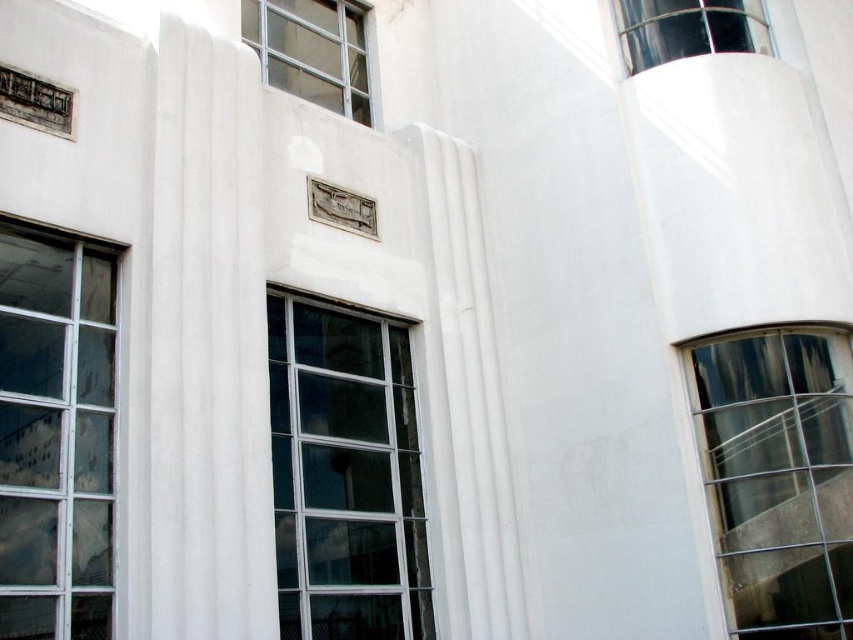
You are an architect reviewing a building facade. You notice the white marble pillar at center and the transparent glass window at upper right. Which object is taller?

The white marble pillar at center is taller than the transparent glass window at upper right according to the description.

You are standing in front of the building and see two points marked on the wall. The first point is at coordinates point (181, 97) and the second is at point (315, 397). Which point is closer to you?

Point (181, 97) is in front of point (315, 397), so the first point is closer to you.